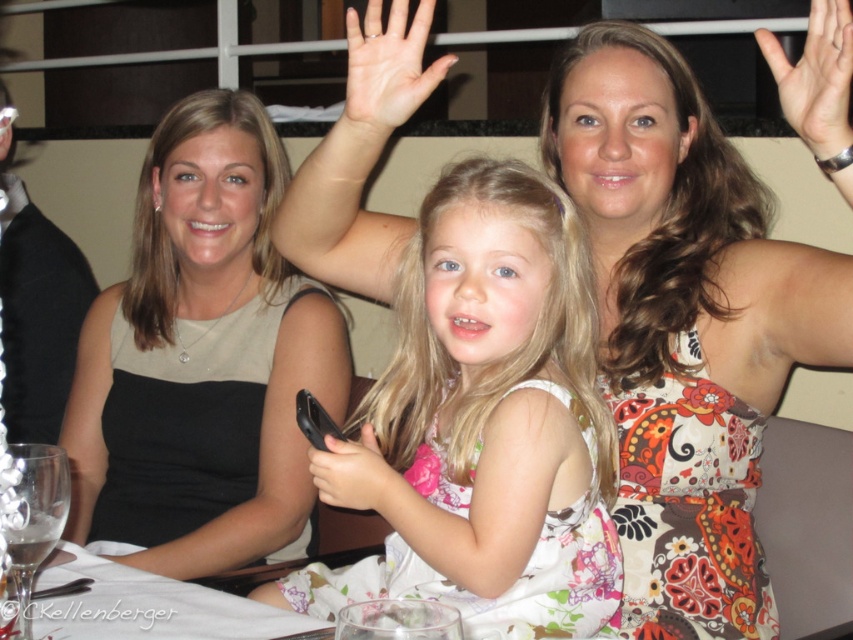
You are a photographer at a social event and need to capture a candid shot of the pale skin at center without including the matte beige dress at left in the frame. Based on their positions, is this possible?

The matte beige dress at left is positioned on the left side of pale skin at center, so if you position your camera to the right of the pale skin at center and frame the shot to exclude the left side, you can capture the pale skin at center without the matte beige dress at left in the frame.

You are a photographer at a social gathering. You need to adjust the camera focus to capture both the matte beige dress at left and the pale skin at center. Which one should you focus on first to ensure proper exposure, considering their sizes in the frame?

The matte beige dress at left is shorter than the pale skin at center, so you should focus on the pale skin at center first because it occupies a larger portion of the frame and requires proper exposure.